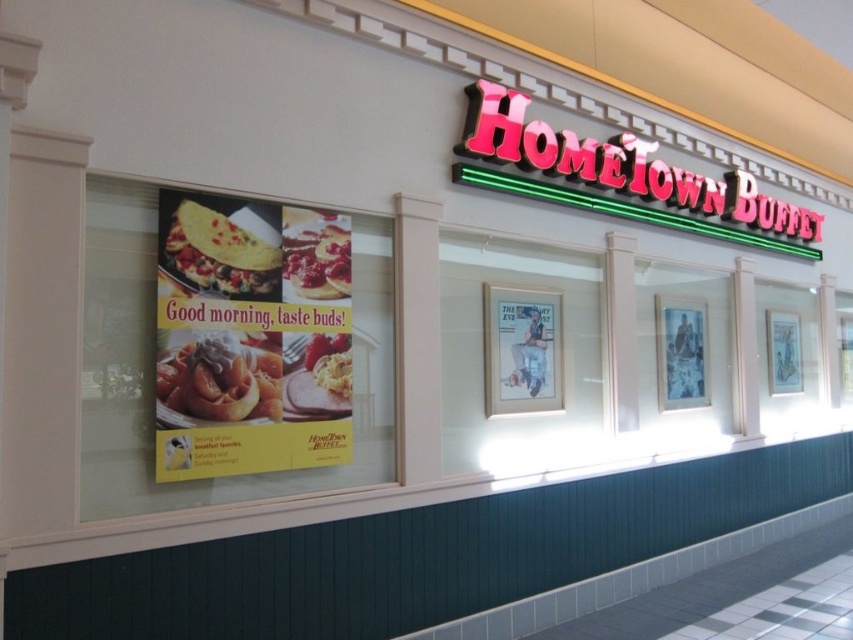
Question: Among these objects, which one is nearest to the camera?

Choices:
 (A) matte yellow omelette at left
 (B) matte yellow omelette at upper left
 (C) golden waffle at center

Answer: (A)

Question: Estimate the real-world distances between objects in this image. Which object is farther from the golden waffle at center?

Choices:
 (A) smooth white pancake at center
 (B) matte yellow omelette at left

Answer: (A)

Question: Does matte yellow omelette at left lie behind matte yellow omelette at upper left?

Choices:
 (A) yes
 (B) no

Answer: (B)

Question: Among these objects, which one is nearest to the camera?

Choices:
 (A) neon sign at upper center
 (B) golden waffle at center
 (C) matte yellow omelette at left

Answer: (C)

Question: Is neon sign at upper center below smooth white pancake at center?

Choices:
 (A) no
 (B) yes

Answer: (A)

Question: Can you confirm if golden waffle at center is positioned below neon sign at upper center?

Choices:
 (A) no
 (B) yes

Answer: (B)